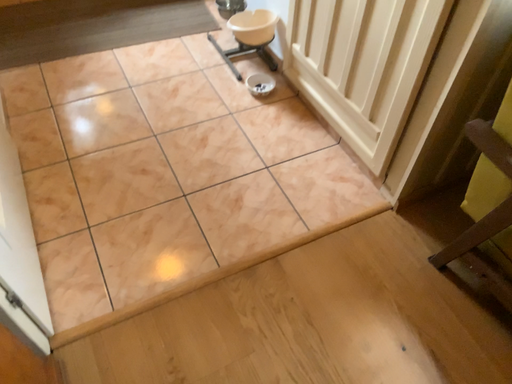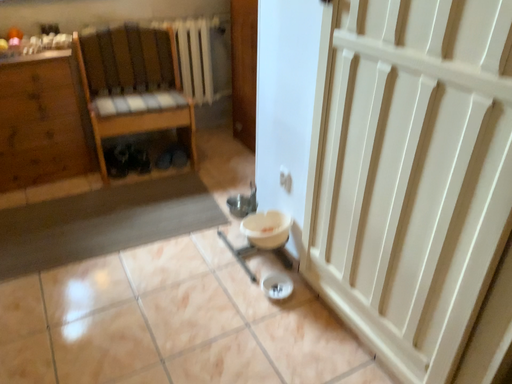
Question: How did the camera likely rotate when shooting the video?

Choices:
 (A) rotated upward
 (B) rotated downward

Answer: (A)